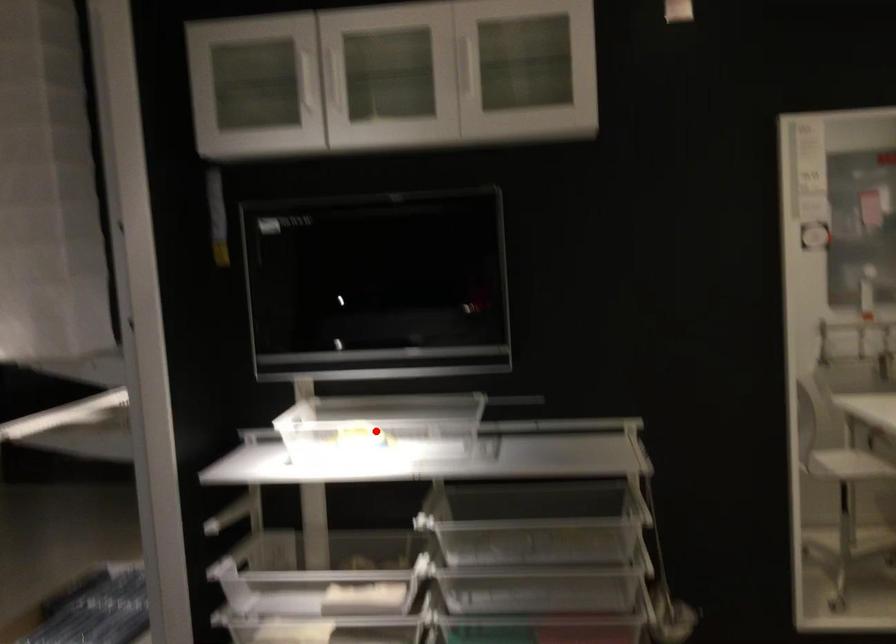
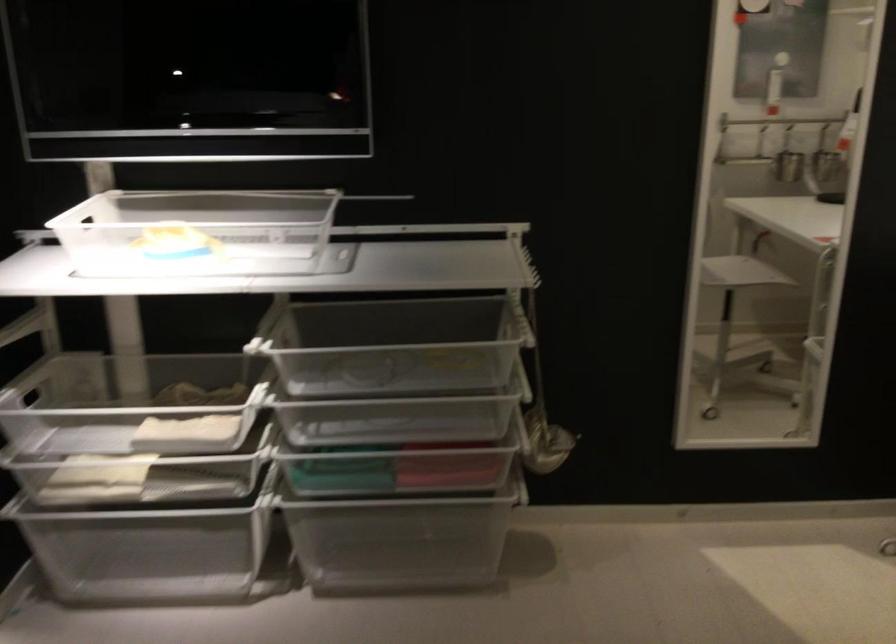
Question: I am providing you with two images of the same scene from different viewpoints. Image1 has a red point marked. In image2, the corresponding 3D location appears at what relative position? Reply with the corresponding letter.

Choices:
 (A) Closer
 (B) Farther

Answer: (A)